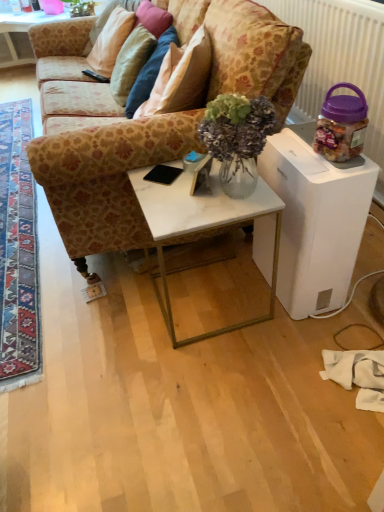
The height and width of the screenshot is (512, 384). What are the coordinates of `free spot above white marble table at center, arranged as the second table when viewed from the front (from a real-world perspective)` in the screenshot? It's located at (184, 188).